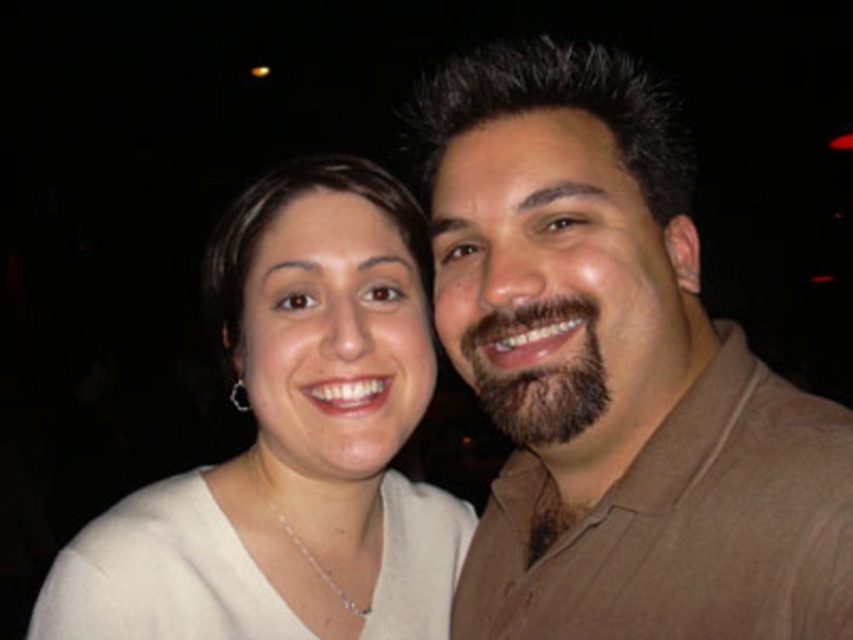
Between brown cotton shirt at right and white matte shirt at center, which one has less height?

white matte shirt at center

Does point (520, 625) come behind point (403, 627)?

No, (520, 625) is in front of (403, 627).

What do you see at coordinates (614, 376) in the screenshot? Image resolution: width=853 pixels, height=640 pixels. I see `brown cotton shirt at right` at bounding box center [614, 376].

I want to click on brown cotton shirt at right, so click(614, 376).